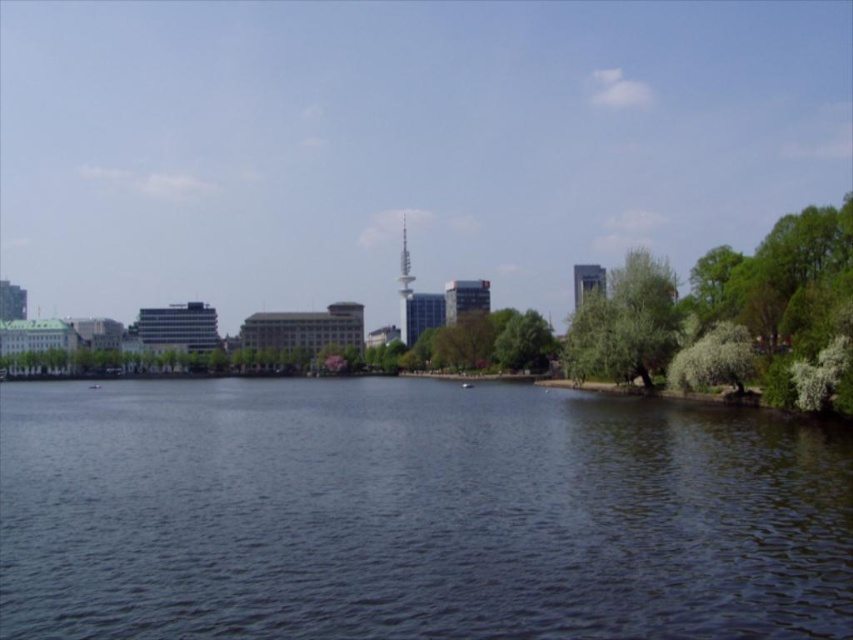
Question: Which point appears farthest from the camera in this image?

Choices:
 (A) (825, 605)
 (B) (572, 362)
 (C) (540, 344)

Answer: (C)

Question: Where is green leafy tree at right located in relation to green leafy tree at center in the image?

Choices:
 (A) below
 (B) above

Answer: (B)

Question: Can you confirm if green leafy tree at right is thinner than metallic silver tower at center?

Choices:
 (A) no
 (B) yes

Answer: (A)

Question: Which point is closer to the camera taking this photo?

Choices:
 (A) (515, 365)
 (B) (624, 275)
 (C) (407, 333)
 (D) (524, 602)

Answer: (D)

Question: Is green leafy tree at right bigger than metallic silver tower at center?

Choices:
 (A) yes
 (B) no

Answer: (A)

Question: Which is farther from the metallic silver tower at center?

Choices:
 (A) green leafy tree at center
 (B) dark blue water at center
 (C) green leafy tree at right

Answer: (B)